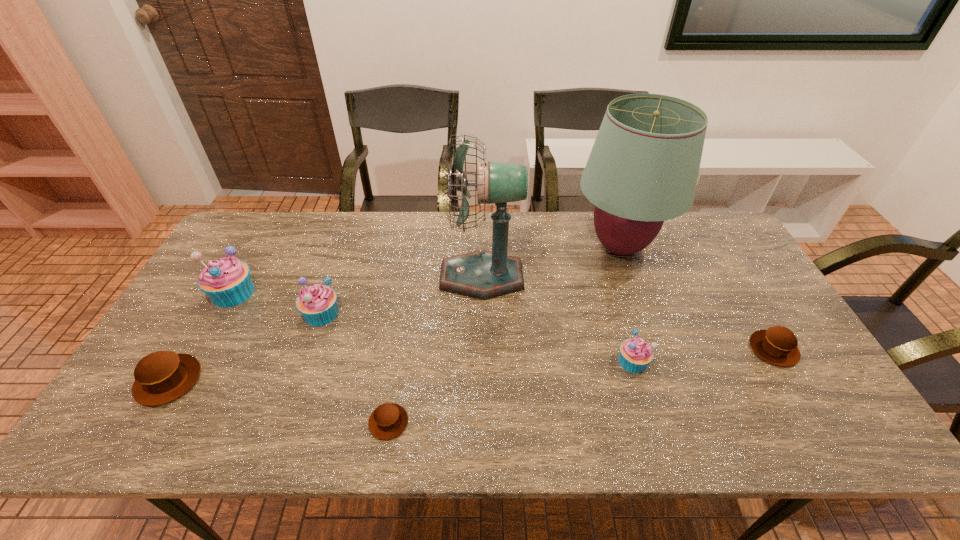
Locate an element on the screen. This screenshot has width=960, height=540. lampshade is located at coordinates (643, 168).

At what (x,y) coordinates should I click in order to perform the action: click on fan. Please return your answer as a coordinate pair (x, y). This screenshot has height=540, width=960. Looking at the image, I should click on (483, 275).

Find the location of a particular element. This screenshot has width=960, height=540. blue fan is located at coordinates (483, 275).

Image resolution: width=960 pixels, height=540 pixels. I want to click on the leftmost blue muffin, so click(x=227, y=282).

At what (x,y) coordinates should I click in order to perform the action: click on the biggest blue muffin. Please return your answer as a coordinate pair (x, y). Looking at the image, I should click on (227, 282).

Identify the location of the second smallest blue muffin. (317, 303).

I want to click on the sixth object from right to left, so click(x=317, y=303).

You are a GUI agent. You are given a task and a screenshot of the screen. Output one action in this format:
    pyautogui.click(x=<x>, y=<y>)
    Task: Click on the second muffin from right to left
    
    Given the screenshot: What is the action you would take?
    pyautogui.click(x=635, y=353)

You are a GUI agent. You are given a task and a screenshot of the screen. Output one action in this format:
    pyautogui.click(x=<x>, y=<y>)
    Task: Click on the nearest blue muffin
    
    Given the screenshot: What is the action you would take?
    pyautogui.click(x=635, y=353)

You are a GUI agent. You are given a task and a screenshot of the screen. Output one action in this format:
    pyautogui.click(x=<x>, y=<y>)
    Task: Click on the leftmost brown muffin
    
    Given the screenshot: What is the action you would take?
    pyautogui.click(x=161, y=377)